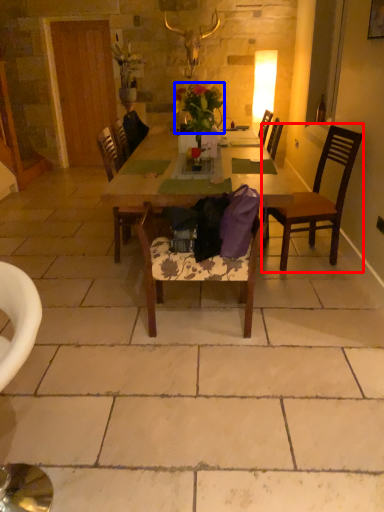
Question: Which point is closer to the camera, chair (highlighted by a red box) or flower (highlighted by a blue box)?

Choices:
 (A) chair
 (B) flower

Answer: (A)